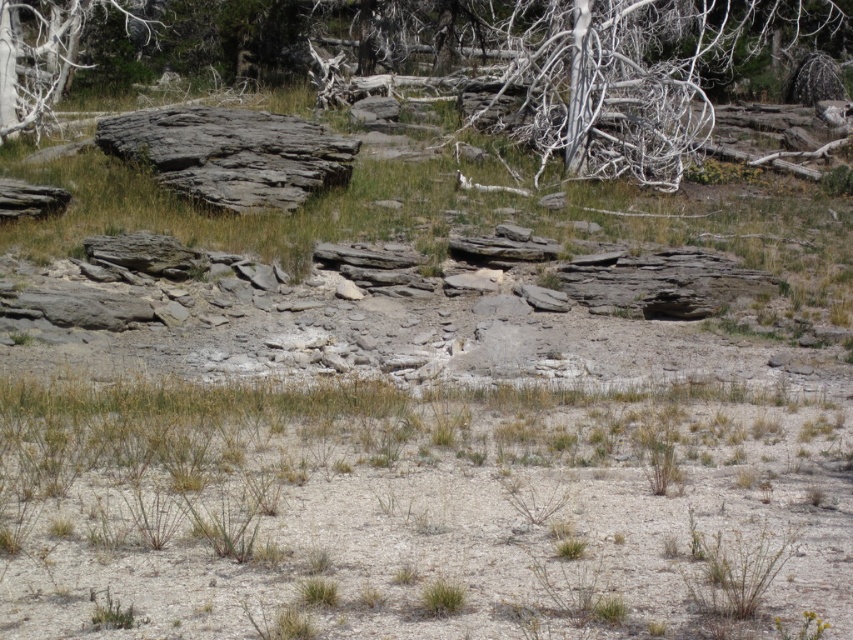
Question: Which object is positioned farthest from the dry grass at lower center?

Choices:
 (A) white bark tree at upper center
 (B) gray bark tree at upper left

Answer: (B)

Question: Can you confirm if dry grass at lower center is positioned to the left of gray bark tree at upper left?

Choices:
 (A) no
 (B) yes

Answer: (A)

Question: Is dry grass at lower center wider than gray bark tree at upper left?

Choices:
 (A) no
 (B) yes

Answer: (B)

Question: Is white bark tree at upper center positioned at the back of gray bark tree at upper left?

Choices:
 (A) no
 (B) yes

Answer: (A)

Question: Which of the following is the closest to the observer?

Choices:
 (A) (540, 170)
 (B) (10, 97)
 (C) (712, 513)

Answer: (C)

Question: Considering the real-world distances, which object is farthest from the white bark tree at upper center?

Choices:
 (A) gray bark tree at upper left
 (B) dry grass at lower center

Answer: (B)